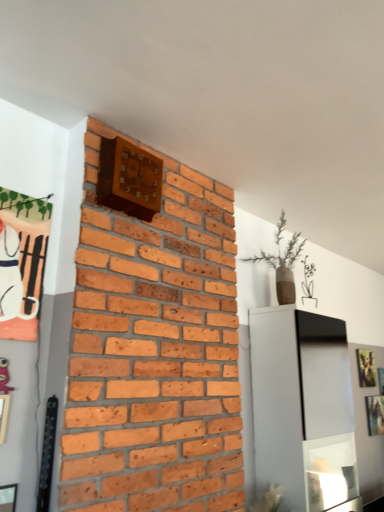
What do you see at coordinates (22, 262) in the screenshot? The width and height of the screenshot is (384, 512). I see `matte orange fabric picture frame at upper left, which is counted as the first picture frame, starting from the top` at bounding box center [22, 262].

Measure the distance between metallic silver picture frame at upper right, which appears as the third picture frame when viewed from the left, and camera.

A distance of 3.24 meters exists between metallic silver picture frame at upper right, which appears as the third picture frame when viewed from the left, and camera.

The height and width of the screenshot is (512, 384). Describe the element at coordinates (270, 501) in the screenshot. I see `green leafy plant at lower center` at that location.

In order to click on gold metallic picture frame at upper right, which is counted as the second picture frame, starting from the right in this screenshot , I will do `click(366, 368)`.

Is metallic silver picture frame at upper right, the third picture frame when ordered from top to bottom, at the right side of matte orange fabric picture frame at upper left, which is counted as the first picture frame, starting from the top?

Indeed, metallic silver picture frame at upper right, the third picture frame when ordered from top to bottom, is positioned on the right side of matte orange fabric picture frame at upper left, which is counted as the first picture frame, starting from the top.

Is point (376, 408) positioned behind point (9, 213)?

Yes, it is.

There is a metallic silver picture frame at upper right, which appears as the third picture frame when viewed from the left. At what (x,y) coordinates should I click in order to perform the action: click on the 2nd picture frame above it (from a real-world perspective). Please return your answer as a coordinate pair (x, y). The width and height of the screenshot is (384, 512). Looking at the image, I should click on (22, 262).

Can you confirm if metallic silver picture frame at upper right, which appears as the third picture frame when viewed from the left, is thinner than matte orange fabric picture frame at upper left, which is counted as the first picture frame, starting from the top?

No.

Can you tell me how much gold metallic picture frame at upper right, which is counted as the second picture frame, starting from the right, and matte orange fabric picture frame at upper left, marked as the third picture frame in a right-to-left arrangement, differ in facing direction?

They differ by 0.563 degrees in their facing directions.

Based on the photo, would you say gold metallic picture frame at upper right, placed as the 3th picture frame when sorted from front to back, contains matte orange fabric picture frame at upper left, which ranks as the first picture frame in left-to-right order?

No, matte orange fabric picture frame at upper left, which ranks as the first picture frame in left-to-right order, is located outside of gold metallic picture frame at upper right, placed as the 3th picture frame when sorted from front to back.

In the image, is gold metallic picture frame at upper right, placed as the 3th picture frame when sorted from front to back, positioned in front of or behind matte orange fabric picture frame at upper left, which ranks as the first picture frame in left-to-right order?

Clearly, gold metallic picture frame at upper right, placed as the 3th picture frame when sorted from front to back, is behind matte orange fabric picture frame at upper left, which ranks as the first picture frame in left-to-right order.

From their relative heights in the image, would you say gold metallic picture frame at upper right, which is counted as the second picture frame, starting from the right, is taller or shorter than green leafy plant at lower center?

Clearly, gold metallic picture frame at upper right, which is counted as the second picture frame, starting from the right, is taller compared to green leafy plant at lower center.

Does gold metallic picture frame at upper right, placed as the 3th picture frame when sorted from front to back, lie behind green leafy plant at lower center?

Yes, gold metallic picture frame at upper right, placed as the 3th picture frame when sorted from front to back, is further from the viewer.

Does gold metallic picture frame at upper right, positioned as the second picture frame in top-to-bottom order, appear on the right side of green leafy plant at lower center?

Indeed, gold metallic picture frame at upper right, positioned as the second picture frame in top-to-bottom order, is positioned on the right side of green leafy plant at lower center.

Could you tell me if metallic silver picture frame at upper right, which is the second picture frame in back-to-front order, is facing green leafy plant at lower center?

No, metallic silver picture frame at upper right, which is the second picture frame in back-to-front order, is not aimed at green leafy plant at lower center.

Consider the image. Does metallic silver picture frame at upper right, which appears as the third picture frame when viewed from the left, have a smaller size compared to green leafy plant at lower center?

Indeed, metallic silver picture frame at upper right, which appears as the third picture frame when viewed from the left, has a smaller size compared to green leafy plant at lower center.

From a real-world perspective, between metallic silver picture frame at upper right, which is the first picture frame in bottom-to-top order, and green leafy plant at lower center, who is vertically lower?

green leafy plant at lower center is physically lower.

Does point (381, 420) lie behind point (249, 510)?

Yes, it is behind point (249, 510).

Is green leafy plant at lower center facing away from metallic silver picture frame at upper right, which ranks as the 2th picture frame in front-to-back order?

That's not correct — green leafy plant at lower center is not looking away from metallic silver picture frame at upper right, which ranks as the 2th picture frame in front-to-back order.

From the image's perspective, is green leafy plant at lower center above metallic silver picture frame at upper right, which is the first picture frame in bottom-to-top order?

Yes.

In order to click on picture frame below the green leafy plant at lower center (from the image's perspective) in this screenshot , I will do `click(375, 414)`.

Who is taller, green leafy plant at lower center or metallic silver picture frame at upper right, the 1th picture frame from the right?

Standing taller between the two is metallic silver picture frame at upper right, the 1th picture frame from the right.

Is matte orange fabric picture frame at upper left, acting as the 3th picture frame starting from the bottom, at the left side of metallic silver picture frame at upper right, the third picture frame when ordered from top to bottom?

Indeed, matte orange fabric picture frame at upper left, acting as the 3th picture frame starting from the bottom, is positioned on the left side of metallic silver picture frame at upper right, the third picture frame when ordered from top to bottom.

From the image's perspective, is matte orange fabric picture frame at upper left, the 3th picture frame positioned from the back, on metallic silver picture frame at upper right, the third picture frame when ordered from top to bottom?

Yes, from the image's perspective, matte orange fabric picture frame at upper left, the 3th picture frame positioned from the back, is over metallic silver picture frame at upper right, the third picture frame when ordered from top to bottom.

Is matte orange fabric picture frame at upper left, marked as the third picture frame in a right-to-left arrangement, taller or shorter than metallic silver picture frame at upper right, the third picture frame when ordered from top to bottom?

In the image, matte orange fabric picture frame at upper left, marked as the third picture frame in a right-to-left arrangement, appears to be taller than metallic silver picture frame at upper right, the third picture frame when ordered from top to bottom.

Which object is thinner, matte orange fabric picture frame at upper left, marked as the third picture frame in a right-to-left arrangement, or metallic silver picture frame at upper right, which is the second picture frame in back-to-front order?

With smaller width is matte orange fabric picture frame at upper left, marked as the third picture frame in a right-to-left arrangement.

Is matte orange fabric picture frame at upper left, the 3th picture frame positioned from the back, shorter than gold metallic picture frame at upper right, placed as the 3th picture frame when sorted from front to back?

Incorrect, the height of matte orange fabric picture frame at upper left, the 3th picture frame positioned from the back, does not fall short of that of gold metallic picture frame at upper right, placed as the 3th picture frame when sorted from front to back.

Is matte orange fabric picture frame at upper left, which ranks as the first picture frame in left-to-right order, in contact with gold metallic picture frame at upper right, positioned as the second picture frame in top-to-bottom order?

They are not placed beside each other.

Which of these two, matte orange fabric picture frame at upper left, marked as the third picture frame in a right-to-left arrangement, or gold metallic picture frame at upper right, arranged as the 2th picture frame when ordered from the bottom, is bigger?

Bigger between the two is gold metallic picture frame at upper right, arranged as the 2th picture frame when ordered from the bottom.

Considering the points (0, 234) and (361, 356), which point is behind, point (0, 234) or point (361, 356)?

Positioned behind is point (361, 356).

Which picture frame is the 1st one when counting from the back of the matte orange fabric picture frame at upper left, which is counted as the first picture frame, starting from the top? Please provide its 2D coordinates.

[(375, 414)]

Locate an element on the screen. Image resolution: width=384 pixels, height=512 pixels. the 1st picture frame below the matte orange fabric picture frame at upper left, the 3th picture frame positioned from the back (from the image's perspective) is located at coordinates (366, 368).

Which object lies nearer to the anchor point matte orange fabric picture frame at upper left, which is counted as the first picture frame, starting from the top, green leafy plant at lower center or gold metallic picture frame at upper right, arranged as the 2th picture frame when ordered from the bottom?

green leafy plant at lower center is positioned closer to the anchor matte orange fabric picture frame at upper left, which is counted as the first picture frame, starting from the top.

Based on their spatial positions, is metallic silver picture frame at upper right, the 1th picture frame from the right, or gold metallic picture frame at upper right, the first picture frame from the back, further from matte orange fabric picture frame at upper left, the first picture frame in the front-to-back sequence?

metallic silver picture frame at upper right, the 1th picture frame from the right, is further to matte orange fabric picture frame at upper left, the first picture frame in the front-to-back sequence.

Based on their spatial positions, is green leafy plant at lower center or metallic silver picture frame at upper right, which appears as the third picture frame when viewed from the left, closer to matte orange fabric picture frame at upper left, acting as the 3th picture frame starting from the bottom?

green leafy plant at lower center.

Consider the image. Estimate the real-world distances between objects in this image. Which object is closer to matte orange fabric picture frame at upper left, marked as the third picture frame in a right-to-left arrangement, metallic silver picture frame at upper right, which is the first picture frame in bottom-to-top order, or green leafy plant at lower center?

green leafy plant at lower center lies closer to matte orange fabric picture frame at upper left, marked as the third picture frame in a right-to-left arrangement, than the other object.

From the image, which object appears to be nearer to green leafy plant at lower center, matte orange fabric picture frame at upper left, the 3th picture frame positioned from the back, or gold metallic picture frame at upper right, which is counted as the second picture frame, starting from the right?

gold metallic picture frame at upper right, which is counted as the second picture frame, starting from the right, lies closer to green leafy plant at lower center than the other object.

Considering their positions, is green leafy plant at lower center positioned closer to gold metallic picture frame at upper right, placed as the 3th picture frame when sorted from front to back, than metallic silver picture frame at upper right, the 1th picture frame from the right?

metallic silver picture frame at upper right, the 1th picture frame from the right.

Considering their positions, is metallic silver picture frame at upper right, which is the first picture frame in bottom-to-top order, positioned closer to gold metallic picture frame at upper right, placed as the 3th picture frame when sorted from front to back, than green leafy plant at lower center?

Based on the image, metallic silver picture frame at upper right, which is the first picture frame in bottom-to-top order, appears to be nearer to gold metallic picture frame at upper right, placed as the 3th picture frame when sorted from front to back.

From the image, which object appears to be nearer to metallic silver picture frame at upper right, which appears as the third picture frame when viewed from the left, green leafy plant at lower center or gold metallic picture frame at upper right, the first picture frame from the back?

gold metallic picture frame at upper right, the first picture frame from the back, lies closer to metallic silver picture frame at upper right, which appears as the third picture frame when viewed from the left, than the other object.

In order to click on plant situated between matte orange fabric picture frame at upper left, the first picture frame in the front-to-back sequence, and metallic silver picture frame at upper right, which appears as the third picture frame when viewed from the left, from left to right in this screenshot , I will do `click(270, 501)`.

Where is `plant between matte orange fabric picture frame at upper left, the 3th picture frame positioned from the back, and gold metallic picture frame at upper right, the second picture frame in the left-to-right sequence`? The width and height of the screenshot is (384, 512). plant between matte orange fabric picture frame at upper left, the 3th picture frame positioned from the back, and gold metallic picture frame at upper right, the second picture frame in the left-to-right sequence is located at coordinates (270, 501).

Locate an element on the screen. The height and width of the screenshot is (512, 384). picture frame between green leafy plant at lower center and gold metallic picture frame at upper right, positioned as the second picture frame in top-to-bottom order, from front to back is located at coordinates (375, 414).

Locate an element on the screen. picture frame located between matte orange fabric picture frame at upper left, the first picture frame in the front-to-back sequence, and metallic silver picture frame at upper right, which is the second picture frame in back-to-front order, in the left-right direction is located at coordinates (366, 368).